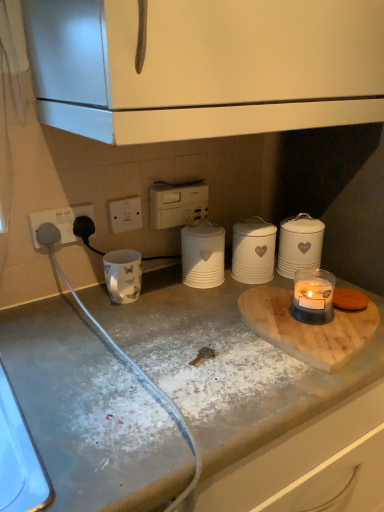
Image resolution: width=384 pixels, height=512 pixels. Describe the element at coordinates (205, 66) in the screenshot. I see `white matte cabinet at upper center` at that location.

I want to click on white matte canister at center, placed as the 2th kitchen appliance when sorted from right to left, so click(x=253, y=251).

Image resolution: width=384 pixels, height=512 pixels. What do you see at coordinates (253, 251) in the screenshot?
I see `white matte canister at center, placed as the 2th kitchen appliance when sorted from right to left` at bounding box center [253, 251].

Find the location of a particular element. white plastic electric outlet at center is located at coordinates (125, 214).

From the image's perspective, is translucent glass candle at lower right under white plastic electric outlet at center?

Indeed, from the image's perspective, translucent glass candle at lower right is shown beneath white plastic electric outlet at center.

Is translucent glass candle at lower right beside white plastic electric outlet at center?

No, translucent glass candle at lower right is not beside white plastic electric outlet at center.

Based on the photo, considering the sizes of objects translucent glass candle at lower right and white plastic electric outlet at center in the image provided, who is shorter, translucent glass candle at lower right or white plastic electric outlet at center?

translucent glass candle at lower right is shorter.

From the image's perspective, between white speckled concrete at center and black rubber power plugs at left, who is located below?

white speckled concrete at center appears lower in the image.

Considering their positions, is white speckled concrete at center located in front of or behind black rubber power plugs at left?

In the image, white speckled concrete at center appears in front of black rubber power plugs at left.

Looking at their sizes, would you say white speckled concrete at center is wider or thinner than black rubber power plugs at left?

white speckled concrete at center is wider than black rubber power plugs at left.

Is white speckled concrete at center oriented away from black rubber power plugs at left?

white speckled concrete at center does not have its back to black rubber power plugs at left.

Between point (312, 300) and point (159, 192), which one is positioned in front?

Positioned in front is point (312, 300).

Would you say translucent glass candle at lower right is to the left or to the right of white plastic electrical outlet at center, marked as the second appliance in a bottom-to-top arrangement, in the picture?

From the image, it's evident that translucent glass candle at lower right is to the right of white plastic electrical outlet at center, marked as the second appliance in a bottom-to-top arrangement.

Would you say translucent glass candle at lower right is a long distance from white plastic electrical outlet at center, marked as the second appliance in a bottom-to-top arrangement?

translucent glass candle at lower right is actually quite close to white plastic electrical outlet at center, marked as the second appliance in a bottom-to-top arrangement.

At what (x,y) coordinates should I click in order to perform the action: click on candle holder in front of the white plastic electrical outlet at center, marked as the second appliance in a bottom-to-top arrangement. Please return your answer as a coordinate pair (x, y). Looking at the image, I should click on (313, 296).

Is black rubber power plugs at left further to the viewer compared to white plastic electric outlet at center?

No.

How different are the orientations of black rubber power plugs at left and white plastic electric outlet at center in degrees?

The angle between the facing direction of black rubber power plugs at left and the facing direction of white plastic electric outlet at center is 0.504 degrees.

Considering the sizes of objects black rubber power plugs at left and white plastic electric outlet at center in the image provided, who is thinner, black rubber power plugs at left or white plastic electric outlet at center?

With smaller width is white plastic electric outlet at center.

Is point (44, 214) farther from camera compared to point (120, 225)?

No.

Between wooden cutting board at center and white ceramic canister at center-right, positioned as the second kitchen appliance in left-to-right order, which one appears on the left side from the viewer's perspective?

wooden cutting board at center is more to the left.

From a real-world perspective, is wooden cutting board at center physically above white ceramic canister at center-right, positioned as the second kitchen appliance in left-to-right order?

Incorrect, from a real-world perspective, wooden cutting board at center is lower than white ceramic canister at center-right, positioned as the second kitchen appliance in left-to-right order.

Is wooden cutting board at center facing away from white ceramic canister at center-right, which ranks as the 1th kitchen appliance in right-to-left order?

That's right, wooden cutting board at center is facing away from white ceramic canister at center-right, which ranks as the 1th kitchen appliance in right-to-left order.

Does white plastic electric outlet at center lie in front of white matte canister at center, placed as the 2th kitchen appliance when sorted from right to left?

No, white plastic electric outlet at center is behind white matte canister at center, placed as the 2th kitchen appliance when sorted from right to left.

Considering the sizes of objects white plastic electric outlet at center and white matte canister at center, which ranks as the 1th kitchen appliance in left-to-right order, in the image provided, who is thinner, white plastic electric outlet at center or white matte canister at center, which ranks as the 1th kitchen appliance in left-to-right order,?

white plastic electric outlet at center is thinner.

Is there a large distance between white plastic electric outlet at center and white matte canister at center, placed as the 2th kitchen appliance when sorted from right to left?

white plastic electric outlet at center is near white matte canister at center, placed as the 2th kitchen appliance when sorted from right to left, not far away.

Is white plastic electric outlet at center inside or outside of white matte canister at center, placed as the 2th kitchen appliance when sorted from right to left?

white plastic electric outlet at center is not inside white matte canister at center, placed as the 2th kitchen appliance when sorted from right to left, it's outside.

Locate an element on the screen. This screenshot has height=512, width=384. cabinetry on the left of wooden cutting board at center is located at coordinates (205, 66).

Is wooden cutting board at center turned away from white matte cabinet at upper center?

wooden cutting board at center is not turned away from white matte cabinet at upper center.

Which is more to the left, wooden cutting board at center or white matte cabinet at upper center?

From the viewer's perspective, white matte cabinet at upper center appears more on the left side.

The image size is (384, 512). I want to click on candle holder located on the right of white plastic electric outlet at center, so click(x=313, y=296).

Identify the location of power plugs and sockets behind the white speckled concrete at center. The image size is (384, 512). (59, 221).

Based on their spatial positions, is white plastic electric outlet at center or white ceramic canister at center-right, which ranks as the 1th kitchen appliance in right-to-left order, further from white matte canister at center, placed as the 2th kitchen appliance when sorted from right to left?

The object further to white matte canister at center, placed as the 2th kitchen appliance when sorted from right to left, is white plastic electric outlet at center.

From the image, which object appears to be nearer to wooden cutting board at center, white plastic electrical outlet at center, the 1th appliance from the top, or white matte cabinet at upper center?

white plastic electrical outlet at center, the 1th appliance from the top.

Estimate the real-world distances between objects in this image. Which object is further from white speckled concrete at center, white ceramic canister at center, which ranks as the 2th appliance in top-to-bottom order, or translucent glass candle at lower right?

Among the two, white ceramic canister at center, which ranks as the 2th appliance in top-to-bottom order, is located further to white speckled concrete at center.

Which object lies further to the anchor point white plastic electrical outlet at center, marked as the second appliance in a bottom-to-top arrangement, white ceramic canister at center-right, which ranks as the 1th kitchen appliance in right-to-left order, or black rubber power plugs at left?

white ceramic canister at center-right, which ranks as the 1th kitchen appliance in right-to-left order, is further to white plastic electrical outlet at center, marked as the second appliance in a bottom-to-top arrangement.

Looking at the image, which one is located further to white ceramic canister at center, which ranks as the 2th appliance in top-to-bottom order, white speckled concrete at center or white plastic electric outlet at center?

white speckled concrete at center is further to white ceramic canister at center, which ranks as the 2th appliance in top-to-bottom order.

When comparing their distances from wooden cutting board at center, does white plastic electrical outlet at center, the 1th appliance from the top, or white matte canister at center, which ranks as the 1th kitchen appliance in left-to-right order, seem further?

white plastic electrical outlet at center, the 1th appliance from the top, lies further to wooden cutting board at center than the other object.

Which object lies further to the anchor point white speckled concrete at center, white plastic electric outlet at center or white ceramic canister at center, which ranks as the 2th appliance in top-to-bottom order?

white plastic electric outlet at center is positioned further to the anchor white speckled concrete at center.

Estimate the real-world distances between objects in this image. Which object is closer to white matte canister at center, placed as the 2th kitchen appliance when sorted from right to left, white ceramic canister at center, the 1th appliance from the bottom, or white speckled concrete at center?

Among the two, white ceramic canister at center, the 1th appliance from the bottom, is located nearer to white matte canister at center, placed as the 2th kitchen appliance when sorted from right to left.

This screenshot has height=512, width=384. What are the coordinates of `cabinetry between black rubber power plugs at left and wooden cutting board at center in the horizontal direction` in the screenshot? It's located at (205, 66).

In order to click on electric outlet between white matte cabinet at upper center and white speckled concrete at center vertically in this screenshot , I will do `click(125, 214)`.

Image resolution: width=384 pixels, height=512 pixels. Identify the location of appliance between wooden cutting board at center and white ceramic canister at center-right, positioned as the second kitchen appliance in left-to-right order, along the z-axis. 203,254.

Identify the location of electric outlet that lies between white plastic electrical outlet at center, marked as the second appliance in a bottom-to-top arrangement, and white speckled concrete at center from top to bottom. This screenshot has height=512, width=384. (125, 214).